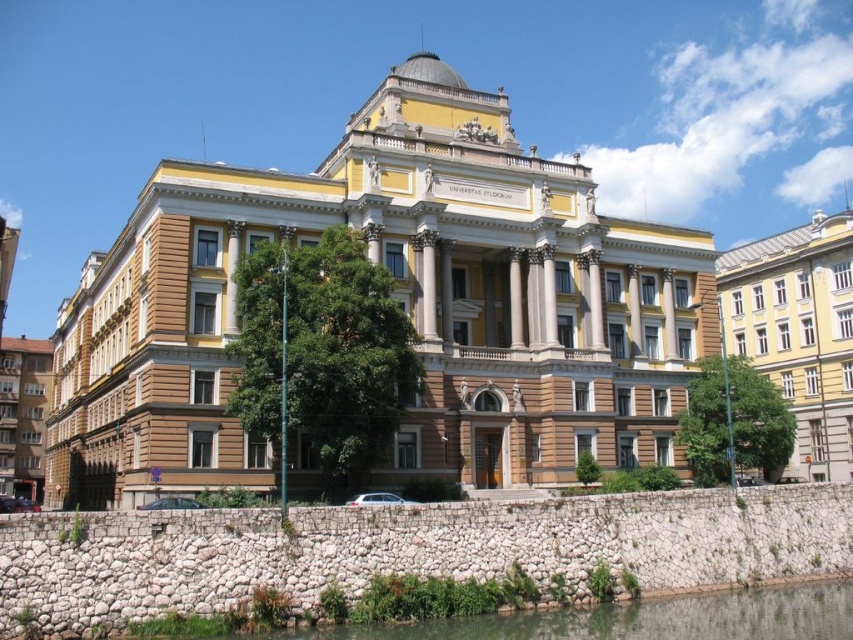
You are an architect evaluating two buildings in the image. The brown stone building at center and the yellow matte building at right. Which building would you recommend for a client who prefers a larger structure for an event venue?

The brown stone building at center is bigger than the yellow matte building at right, so it would be more suitable for a client seeking a larger event venue.

You are standing on the stone wall in front of the yellow matte building at right and clear water at lower center. Which object is higher from the ground? Please answer based on their heights.

The yellow matte building at right is taller than the clear water at lower center, so the yellow matte building at right is higher from the ground.

You are a tourist standing in front of the brown stone building at center and the yellow matte building at right. Which building is closer to the water body shown in the scene?

The yellow matte building at right is closer to the water body because the brown stone building at center is to the left of it, placing the yellow matte building at right further towards the water.